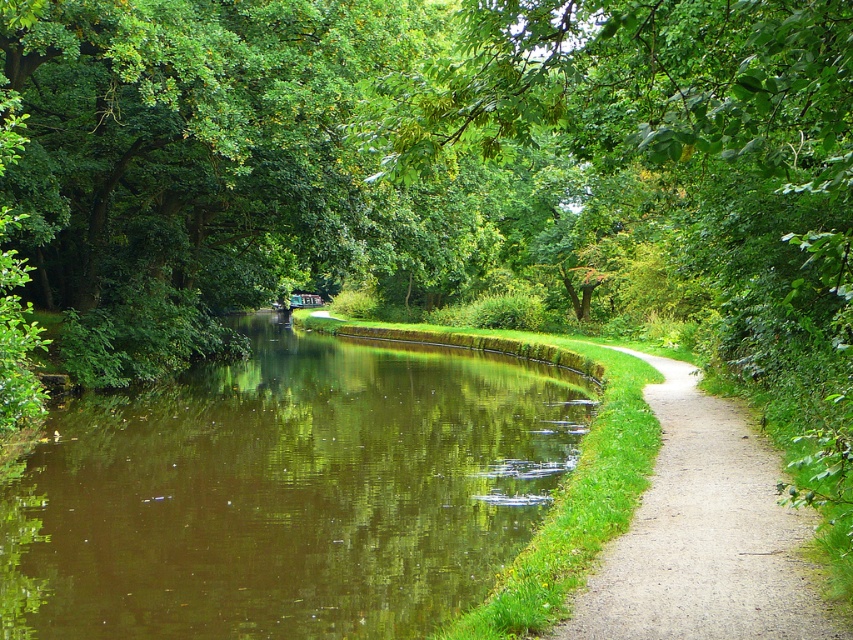
Question: Which point is closer to the camera?

Choices:
 (A) (312, 634)
 (B) (846, 282)

Answer: (B)

Question: Which of the following is the closest to the observer?

Choices:
 (A) green leafy tree at center
 (B) gravel path at right
 (C) brown reflective water at center

Answer: (A)

Question: Considering the real-world distances, which object is closest to the green leafy tree at center?

Choices:
 (A) gravel path at right
 (B) brown reflective water at center

Answer: (B)

Question: Can you confirm if brown reflective water at center is smaller than green leafy tree at center?

Choices:
 (A) no
 (B) yes

Answer: (B)

Question: Does brown reflective water at center have a greater width compared to gravel path at right?

Choices:
 (A) yes
 (B) no

Answer: (A)

Question: Is brown reflective water at center thinner than gravel path at right?

Choices:
 (A) no
 (B) yes

Answer: (A)